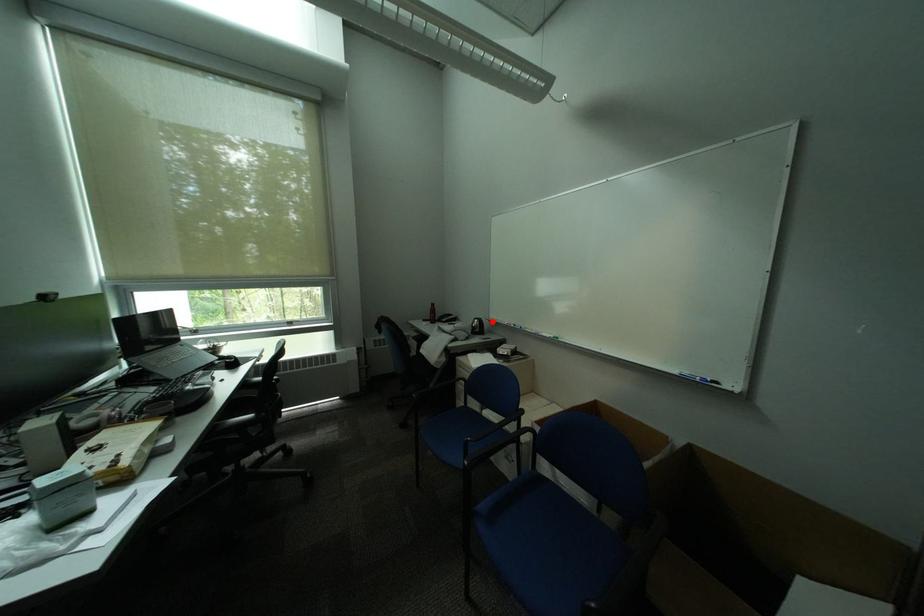
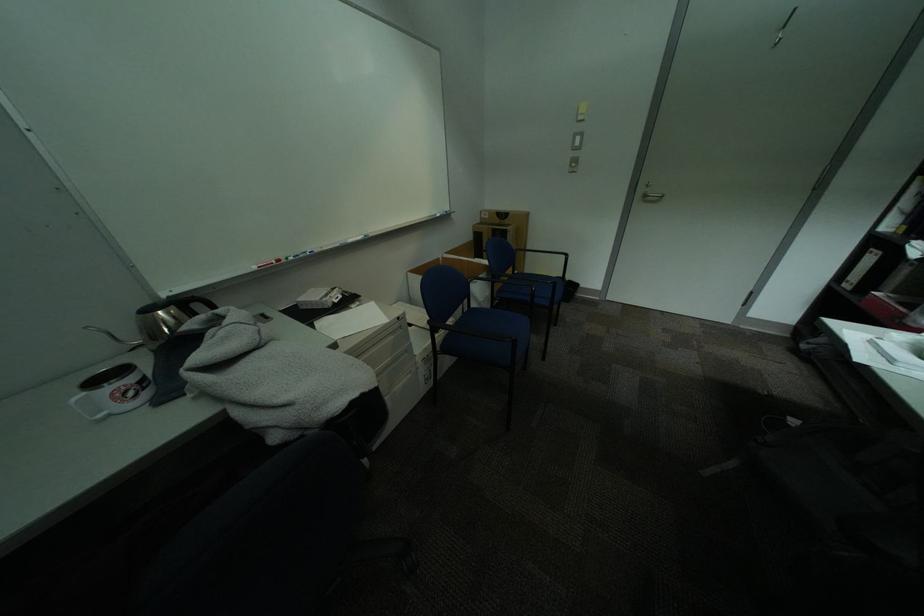
Locate, in the second image, the point that corresponds to the highlighted location in the first image.

(204, 297)